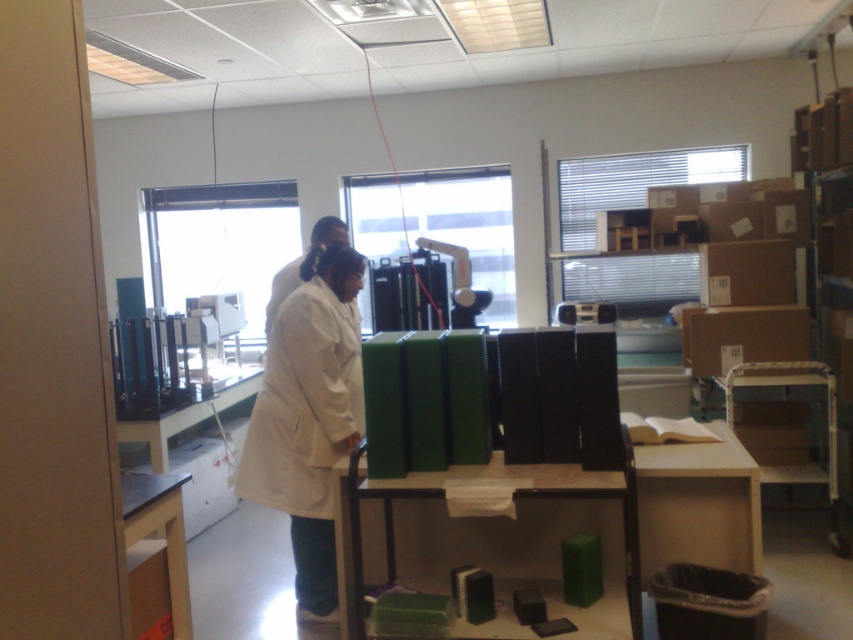
You are a new scientist entering the lab and need to choose a lab coat to wear. There are two lab coats available at the center of the table. One is labeled as white matte lab coat at center and the other is white lab coat at center. Which one is wider?

The white matte lab coat at center is wider than the white lab coat at center according to the description.

You are a new intern in the lab and need to determine the arrangement of the lab coats. Which lab coat, the white matte lab coat at center or the white lab coat at center, is located to the right of the other?

The white matte lab coat at center is positioned on the right side of white lab coat at center.

You are a researcher in the lab and need to move from your current position to the table with the green boxes. There are two points marked on the floor at coordinates point (265, 428) and point (323, 244). Which point should you step on first to reach the table more directly?

You should step on point (265, 428) first because it is in front of point 0.380, 0.380, meaning it is closer to the table and provides a more direct path.